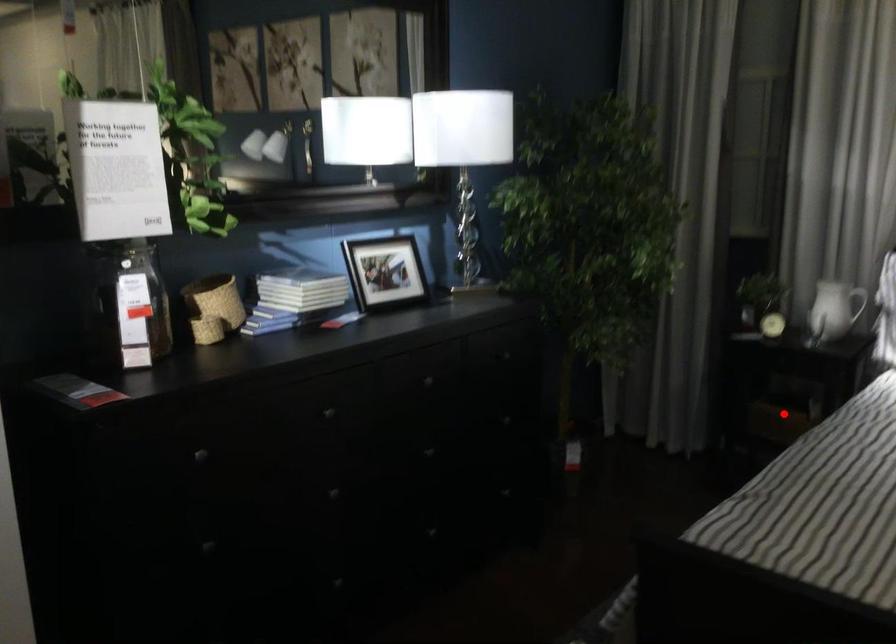
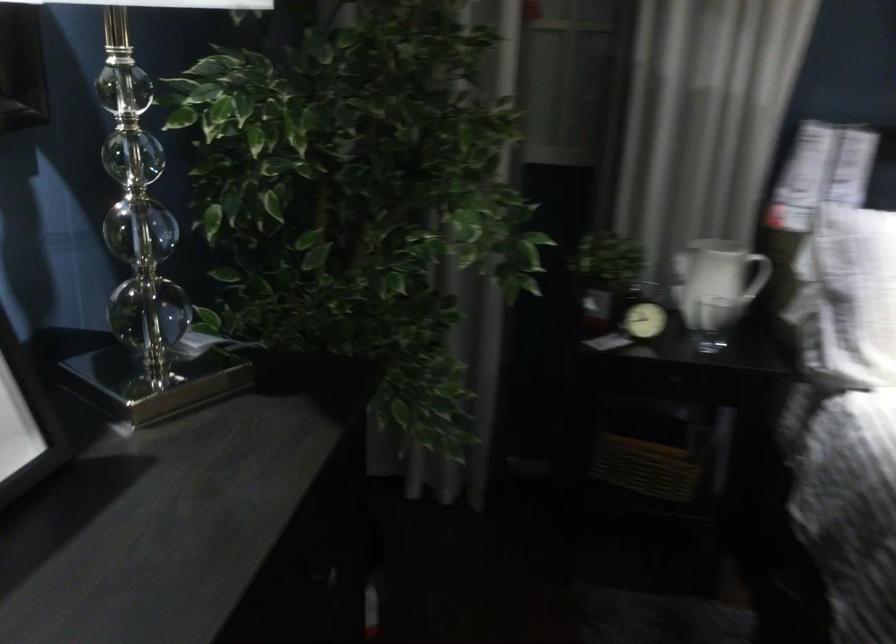
Question: I am providing you with two images of the same scene from different viewpoints. Given a red point in image1, look at the same physical point in image2. Is it:

Choices:
 (A) Closer to the viewpoint
 (B) Farther from the viewpoint

Answer: (A)